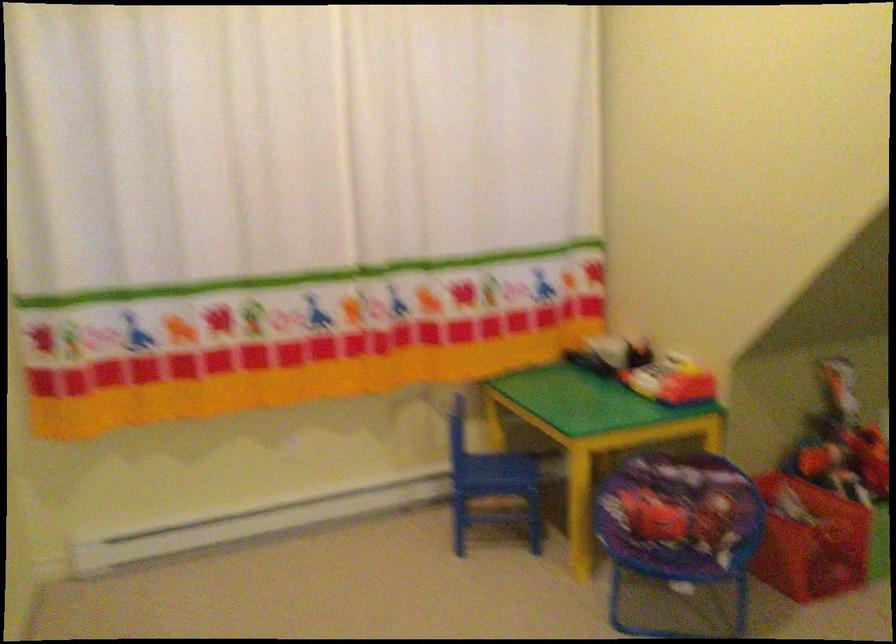
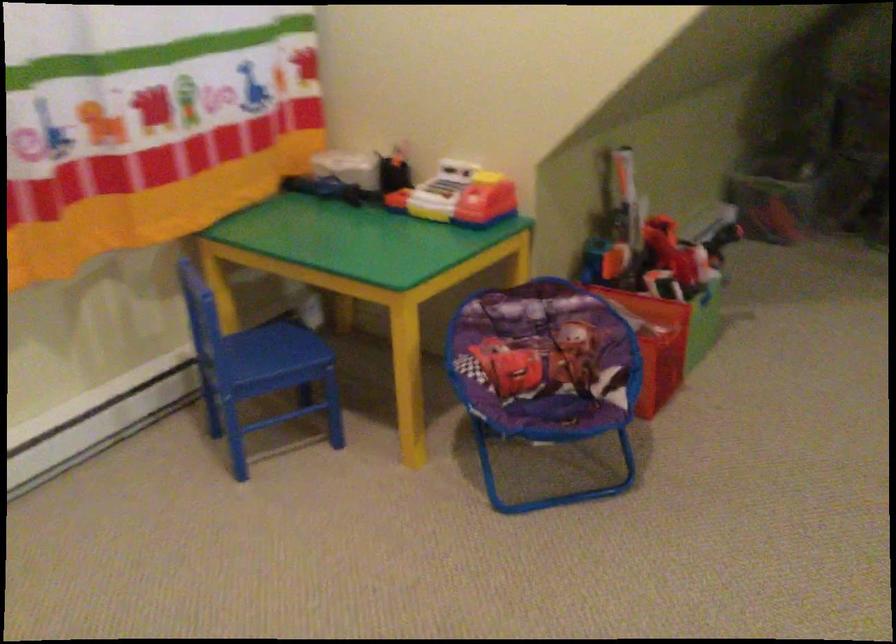
Where in the second image is the point corresponding to (667,377) from the first image?

(458, 196)